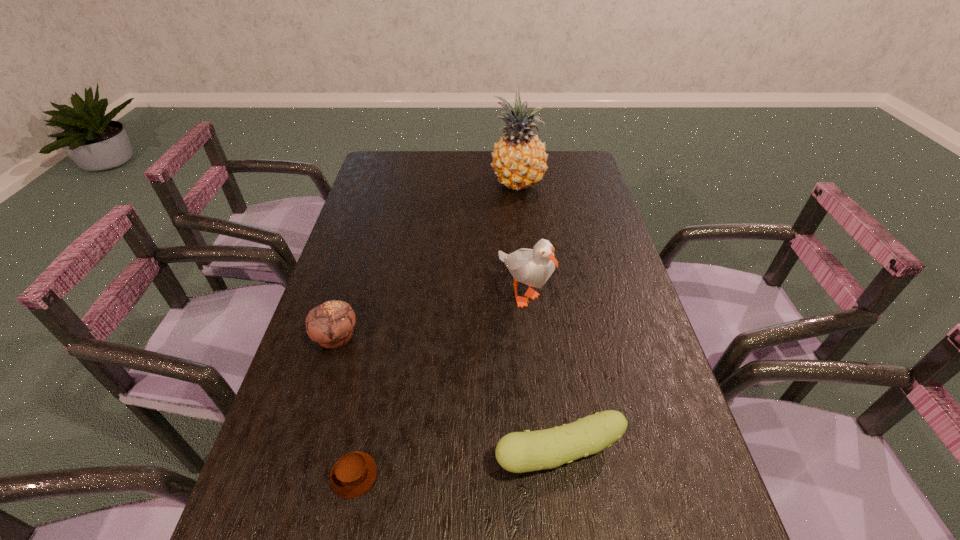
This screenshot has height=540, width=960. What are the coordinates of `pineapple` in the screenshot? It's located at (519, 160).

Image resolution: width=960 pixels, height=540 pixels. I want to click on the farthest object, so click(x=519, y=160).

You are a GUI agent. You are given a task and a screenshot of the screen. Output one action in this format:
    pyautogui.click(x=<x>, y=<y>)
    Task: Click on the second tallest object
    This screenshot has height=540, width=960.
    Given the screenshot: What is the action you would take?
    pyautogui.click(x=533, y=267)

I want to click on the farther muffin, so click(330, 324).

Where is `the taller muffin`? The image size is (960, 540). the taller muffin is located at coordinates (330, 324).

Where is `cucumber`? Image resolution: width=960 pixels, height=540 pixels. cucumber is located at coordinates (518, 452).

Where is `the fourth object from right to left`? Image resolution: width=960 pixels, height=540 pixels. the fourth object from right to left is located at coordinates (353, 474).

Locate an element on the screen. The width and height of the screenshot is (960, 540). the right muffin is located at coordinates (353, 474).

At what (x,y) coordinates should I click in order to perform the action: click on free space located 0.130m on the left of the farthest object. Please return your answer as a coordinate pair (x, y). The height and width of the screenshot is (540, 960). Looking at the image, I should click on (454, 184).

Locate an element on the screen. vacant space positioned at the beak of the second tallest object is located at coordinates (532, 369).